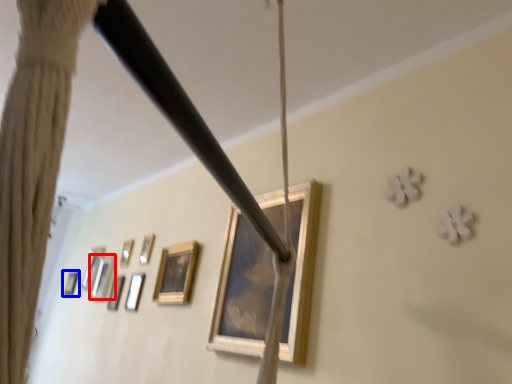
Question: Which object appears farthest to the camera in this image, picture frame (highlighted by a red box) or picture frame (highlighted by a blue box)?

Choices:
 (A) picture frame
 (B) picture frame

Answer: (B)